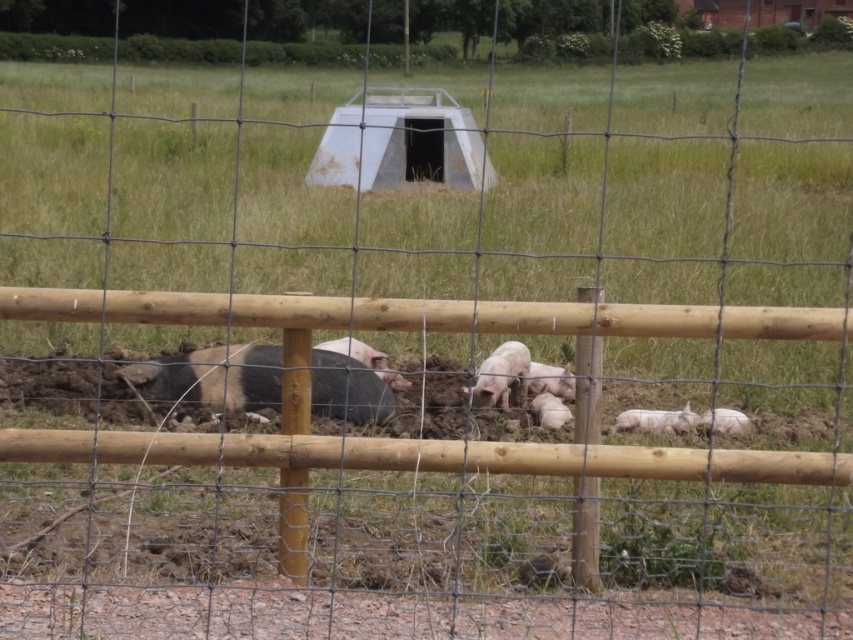
Question: Among these objects, which one is nearest to the camera?

Choices:
 (A) white fluffy piglet at lower right
 (B) speckled fur pig at center
 (C) pink matte pig at center
 (D) white matte piglet at center

Answer: (B)

Question: Which point is closer to the camera?

Choices:
 (A) speckled fur pig at center
 (B) pink matte pig at center
 (C) white matte piglet at center
 (D) white fluffy pig at lower center

Answer: (A)

Question: Which point is closer to the camera taking this photo?

Choices:
 (A) (317, 387)
 (B) (485, 369)
 (C) (376, 371)

Answer: (C)

Question: In this image, where is gray speckled pig at center located relative to pink smooth pig at center?

Choices:
 (A) right
 (B) left

Answer: (B)

Question: Does white fluffy piglet at lower right appear on the left side of white matte piglet at center?

Choices:
 (A) no
 (B) yes

Answer: (A)

Question: From the image, what is the correct spatial relationship of white fluffy pig at lower center in relation to gray speckled pig at center?

Choices:
 (A) above
 (B) below

Answer: (B)